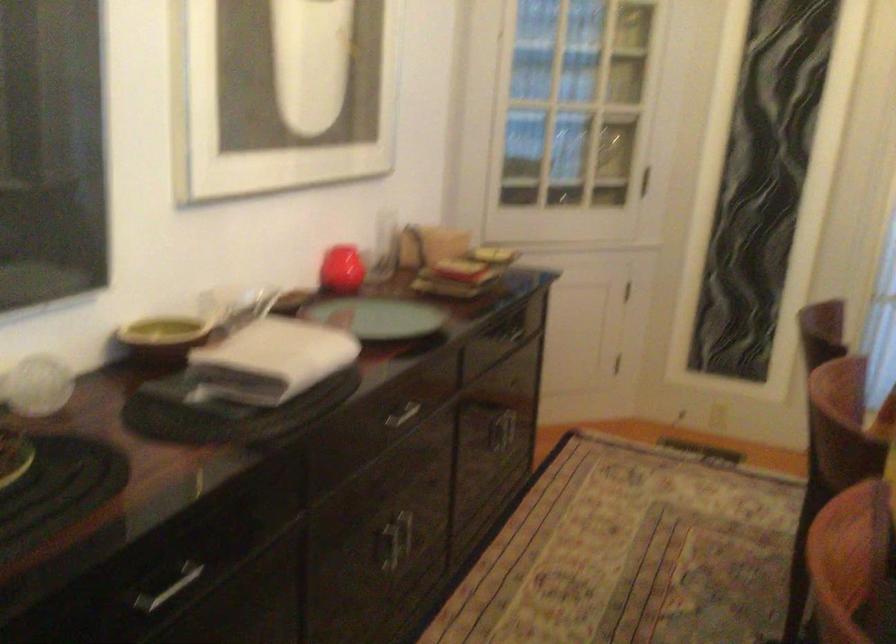
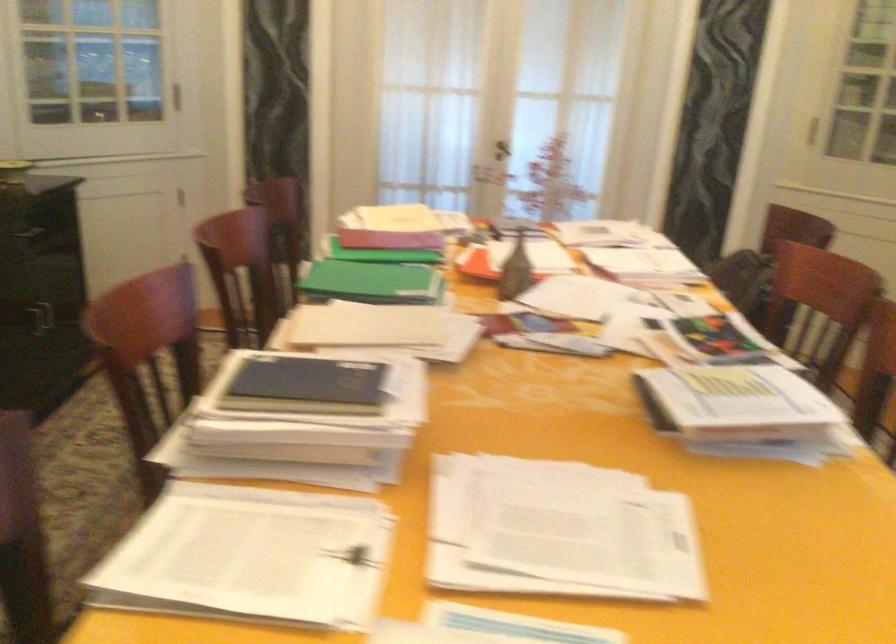
Question: How did the camera likely rotate?

Choices:
 (A) Left
 (B) Right
 (C) Up
 (D) Down

Answer: (B)